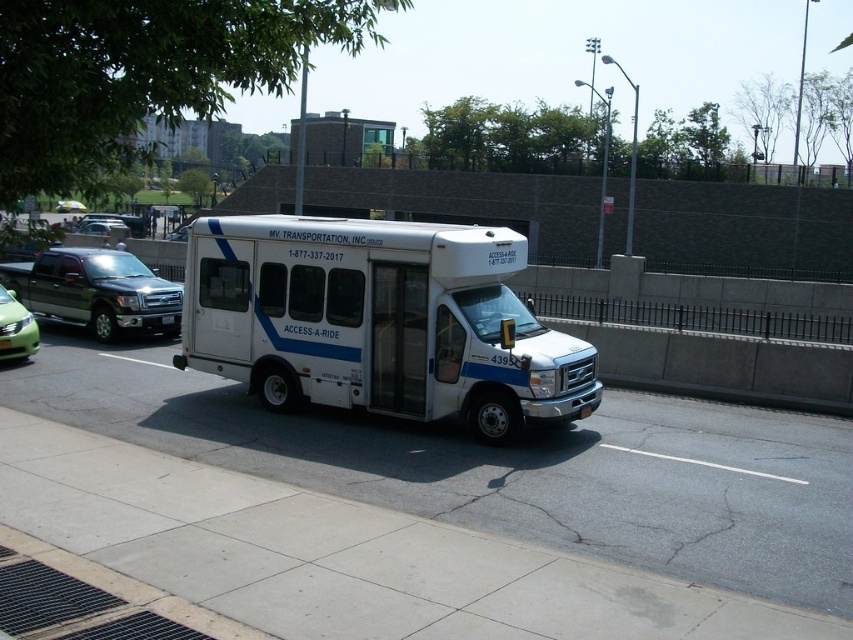
You are a delivery person who needs to park your 2.5 meter wide delivery van. You see the white matte van at center and the metallic gray truck at left. Which vehicle has enough space to park your delivery van next to it without overlapping?

The white matte van at center has a width that surpasses the metallic gray truck at left, so parking next to the white matte van at center would provide sufficient space for your 2.5 meter wide delivery van.

You are a delivery person who needs to park your vehicle between the white matte van at center and the metallic gray truck at left. Which vehicle should you park closer to if you want to maximize the remaining space for other vehicles?

The white matte van at center is bigger than the metallic gray truck at left, so you should park closer to the metallic gray truck at left to leave more space for other vehicles.

Based on the scene description and the coordinates provided, what object is located at point (378,321)?

The white matte van at center is located at point (378,321).